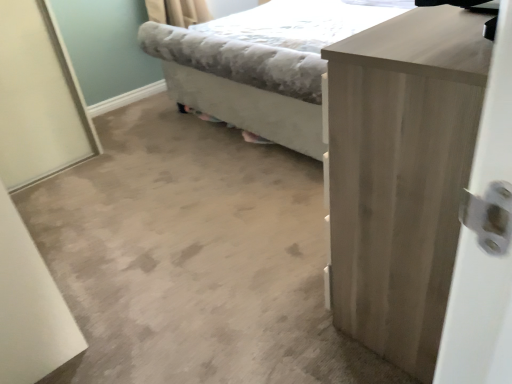
In order to face light wood cabinet at right, should I rotate leftwards or rightwards?

You should rotate right by 24.572 degrees.

Describe the element at coordinates (401, 175) in the screenshot. I see `light wood cabinet at right` at that location.

This screenshot has width=512, height=384. What are the coordinates of `light wood cabinet at right` in the screenshot? It's located at (401, 175).

Where is `light gray fabric bed at center`? The image size is (512, 384). light gray fabric bed at center is located at coordinates (260, 65).

Measure the distance between light gray fabric bed at center and camera.

1.72 meters.

The width and height of the screenshot is (512, 384). Describe the element at coordinates (260, 65) in the screenshot. I see `light gray fabric bed at center` at that location.

Locate an element on the screen. light wood cabinet at right is located at coordinates (401, 175).

Does light wood cabinet at right appear on the right side of light gray fabric bed at center?

Incorrect, light wood cabinet at right is not on the right side of light gray fabric bed at center.

Which is behind, light wood cabinet at right or light gray fabric bed at center?

light gray fabric bed at center is more distant.

Which is closer to the camera, (387,196) or (140,46)?

The point (387,196) is closer to the camera.

From the image's perspective, who appears lower, light wood cabinet at right or light gray fabric bed at center?

light wood cabinet at right is shown below in the image.

From a real-world perspective, is light wood cabinet at right above or below light gray fabric bed at center?

light wood cabinet at right is situated higher than light gray fabric bed at center in the real world.

Looking at this image, is light wood cabinet at right thinner than light gray fabric bed at center?

Correct, the width of light wood cabinet at right is less than that of light gray fabric bed at center.

Consider the image. Can you confirm if light wood cabinet at right is taller than light gray fabric bed at center?

Correct, light wood cabinet at right is much taller as light gray fabric bed at center.

Considering the relative sizes of light wood cabinet at right and light gray fabric bed at center in the image provided, is light wood cabinet at right bigger than light gray fabric bed at center?

No, light wood cabinet at right is not bigger than light gray fabric bed at center.

Is light gray fabric bed at center surrounded by light wood cabinet at right?

No, light wood cabinet at right does not contain light gray fabric bed at center.

Is light wood cabinet at right next to light gray fabric bed at center and touching it?

No, light wood cabinet at right is not with light gray fabric bed at center.

Consider the image. Is light wood cabinet at right turned away from light gray fabric bed at center?

light wood cabinet at right is not turned away from light gray fabric bed at center.

The width and height of the screenshot is (512, 384). Find the location of `chest of drawers to the left of light gray fabric bed at center`. chest of drawers to the left of light gray fabric bed at center is located at coordinates (401, 175).

Considering the relative positions of light gray fabric bed at center and light wood cabinet at right in the image provided, is light gray fabric bed at center to the left or to the right of light wood cabinet at right?

light gray fabric bed at center is to the right of light wood cabinet at right.

Which is in front, light gray fabric bed at center or light wood cabinet at right?

light wood cabinet at right is closer to the camera.

Does point (246, 116) come closer to viewer compared to point (397, 291)?

That is False.

From the image's perspective, is light gray fabric bed at center above light wood cabinet at right?

Yes, from the image's perspective, light gray fabric bed at center is above light wood cabinet at right.

From a real-world perspective, is light gray fabric bed at center physically below light wood cabinet at right?

Indeed, from a real-world perspective, light gray fabric bed at center is positioned beneath light wood cabinet at right.

Is light gray fabric bed at center wider or thinner than light wood cabinet at right?

Clearly, light gray fabric bed at center has more width compared to light wood cabinet at right.

Between light gray fabric bed at center and light wood cabinet at right, which one has less height?

light gray fabric bed at center.

Which of these two, light gray fabric bed at center or light wood cabinet at right, is bigger?

With larger size is light gray fabric bed at center.

Do you think light gray fabric bed at center is within light wood cabinet at right, or outside of it?

light gray fabric bed at center is spatially situated outside light wood cabinet at right.

Can you see light gray fabric bed at center touching light wood cabinet at right?

No, light gray fabric bed at center is not beside light wood cabinet at right.

Is light gray fabric bed at center positioned with its back to light wood cabinet at right?

No.

How far apart are light gray fabric bed at center and light wood cabinet at right?

light gray fabric bed at center and light wood cabinet at right are 3.90 feet apart.

Locate an element on the screen. chest of drawers to the left of light gray fabric bed at center is located at coordinates tap(401, 175).

Where is `the chest of drawers that appears above the light gray fabric bed at center (from a real-world perspective)`? the chest of drawers that appears above the light gray fabric bed at center (from a real-world perspective) is located at coordinates (401, 175).

At what (x,y) coordinates should I click in order to perform the action: click on the chest of drawers located in front of the light gray fabric bed at center. Please return your answer as a coordinate pair (x, y). The height and width of the screenshot is (384, 512). Looking at the image, I should click on (401, 175).